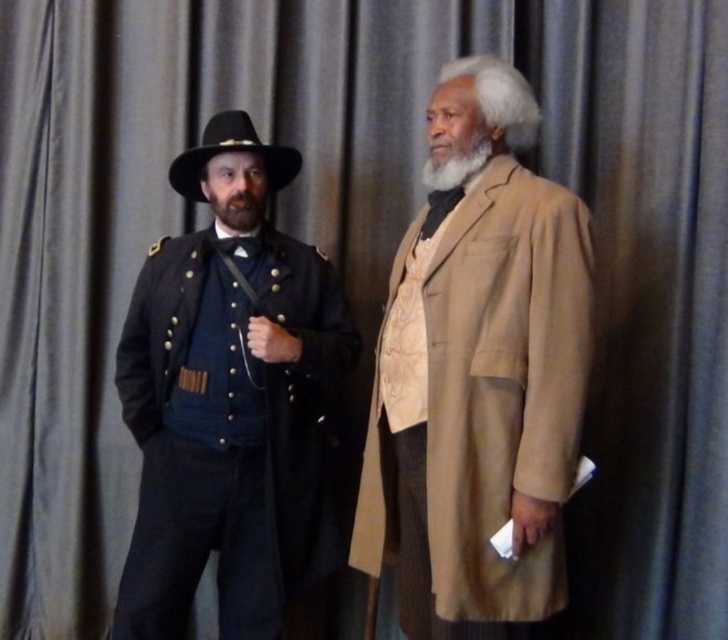
Question: Is matte blue uniform at left above graywoollybeard at right?

Choices:
 (A) yes
 (B) no

Answer: (B)

Question: Among these objects, which one is nearest to the camera?

Choices:
 (A) beige wool coat at right
 (B) matte blue uniform at left
 (C) black felt cowboy hat at left

Answer: (A)

Question: Based on their relative distances, which object is farther from the beige wool coat at right?

Choices:
 (A) matte blue uniform at left
 (B) dark brown fuzzy beard at left

Answer: (B)

Question: Can you confirm if beige wool coat at right is bigger than matte blue uniform at left?

Choices:
 (A) no
 (B) yes

Answer: (B)

Question: Which point is farther to the camera?

Choices:
 (A) beige wool coat at right
 (B) black felt cowboy hat at left
 (C) dark brown fuzzy beard at left

Answer: (C)

Question: Is the position of beige wool coat at right more distant than that of graywoollybeard at right?

Choices:
 (A) yes
 (B) no

Answer: (B)